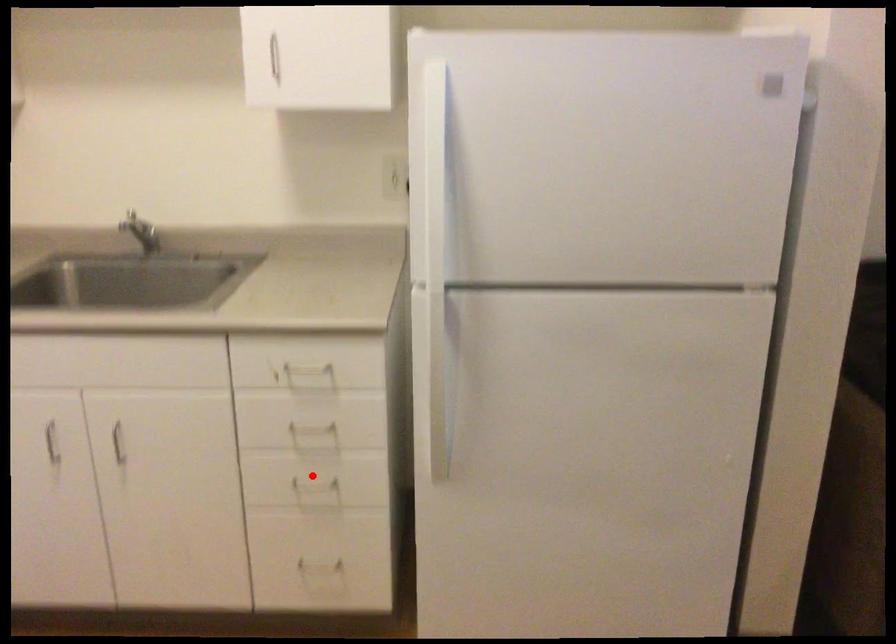
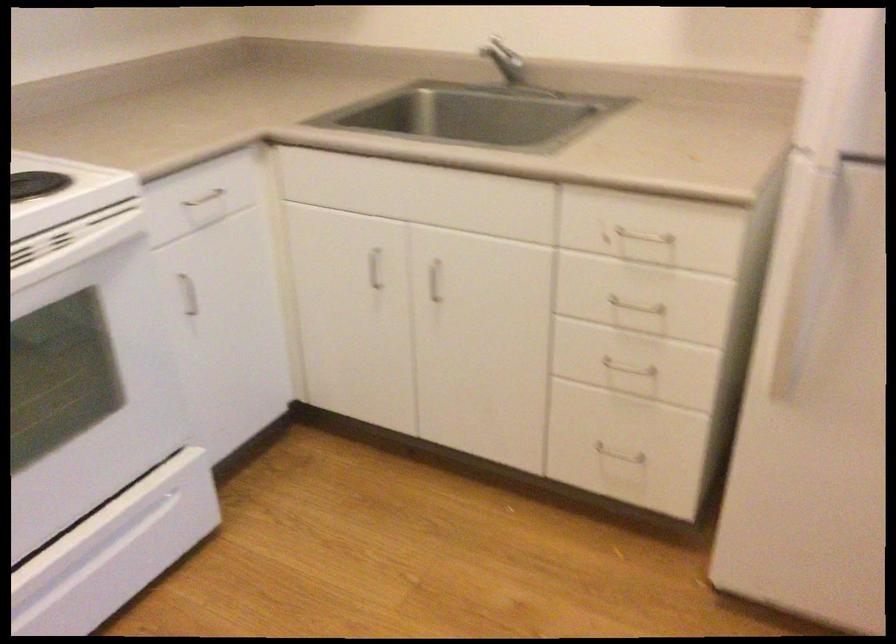
Question: I am providing you with two images of the same scene from different viewpoints. In image1, a red point is highlighted. Considering the same 3D point in image2, which of the following is correct?

Choices:
 (A) It is closer
 (B) It is farther

Answer: (A)